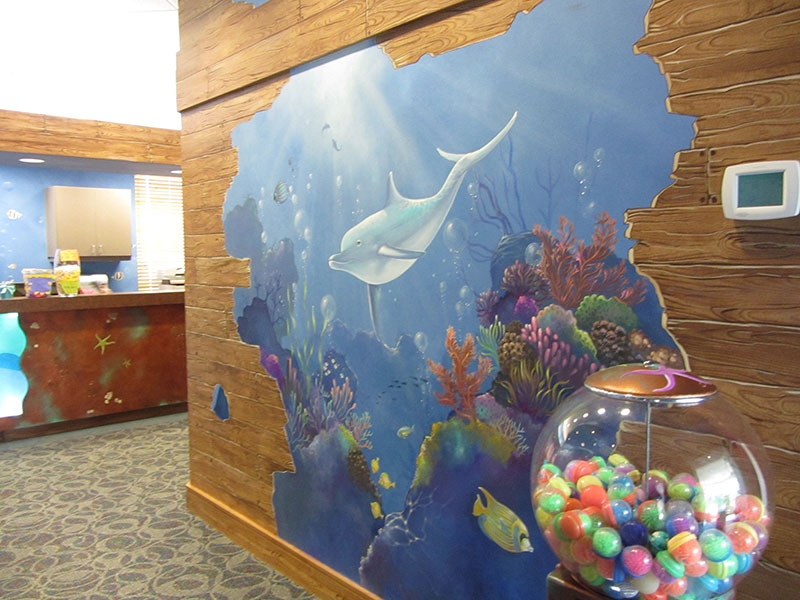
Where is `blinds`? blinds is located at coordinates (168, 230).